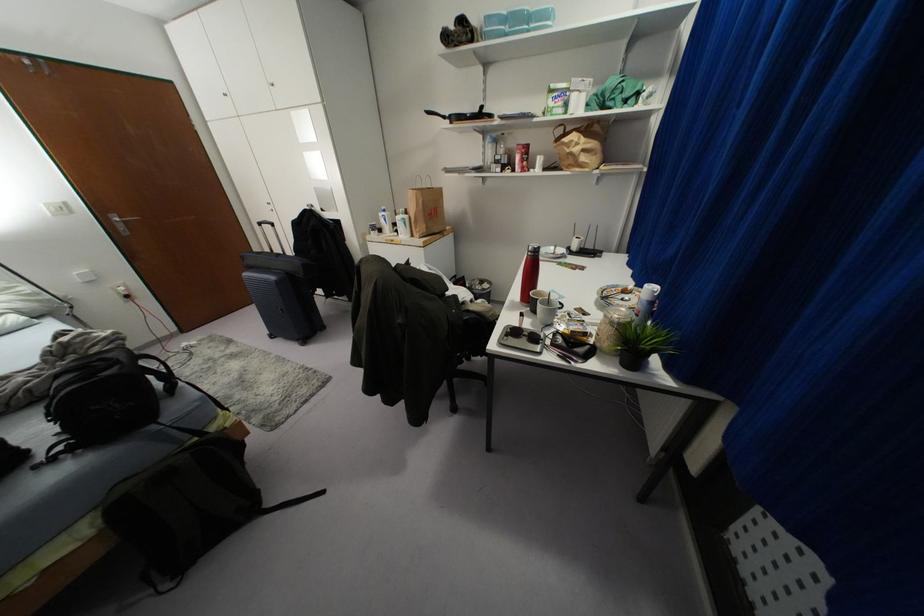
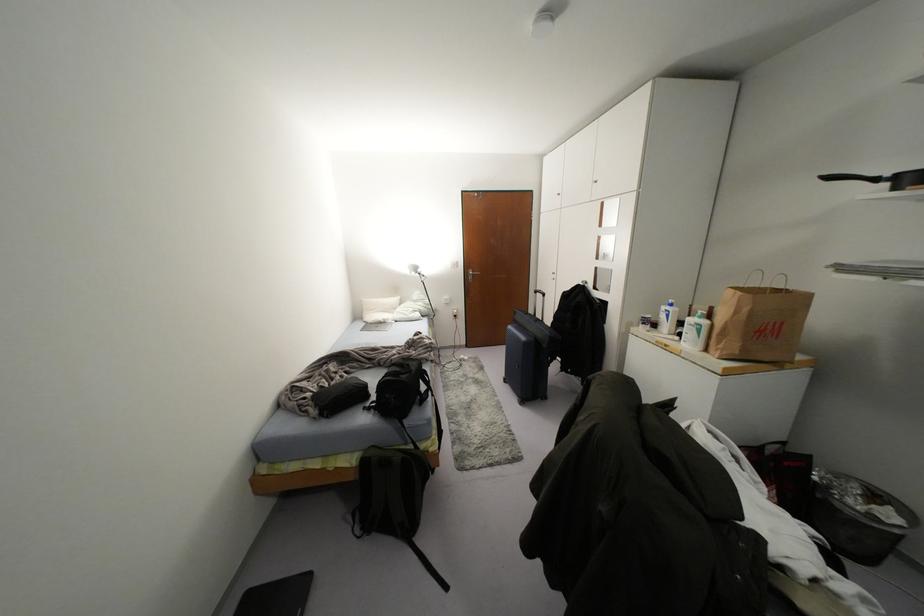
In the second image, find the point that corresponds to point (120, 228) in the first image.

(469, 277)